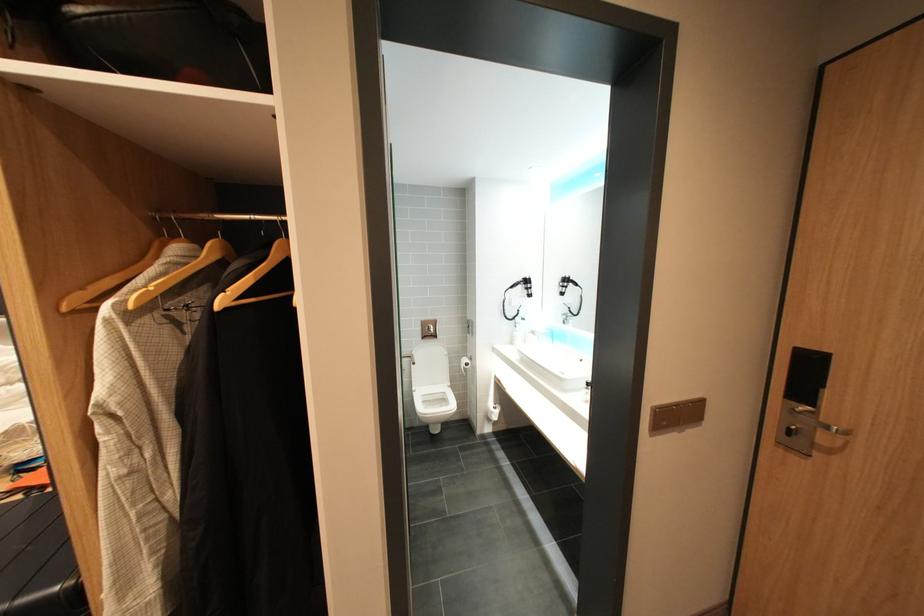
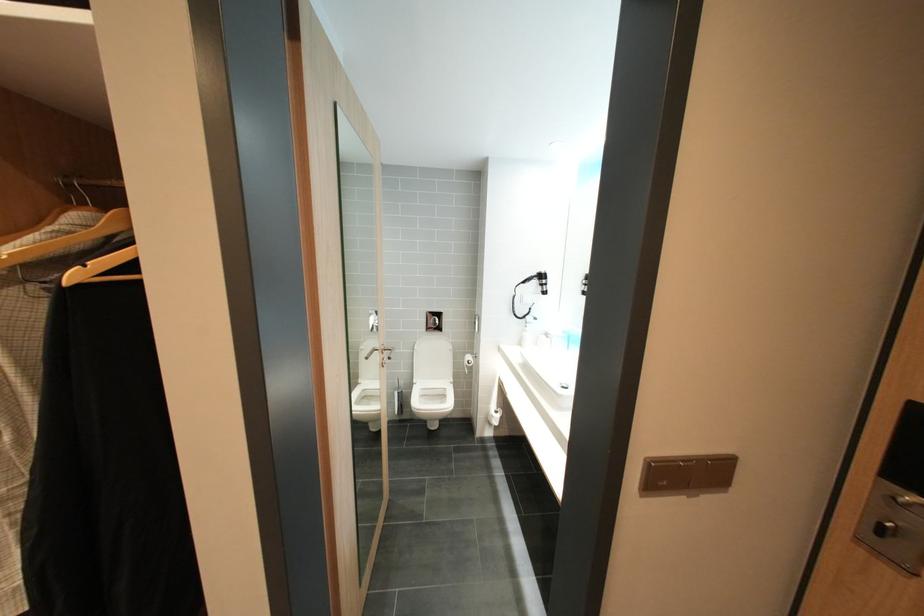
Find the pixel in the second image that matches (499,416) in the first image.

(499, 419)